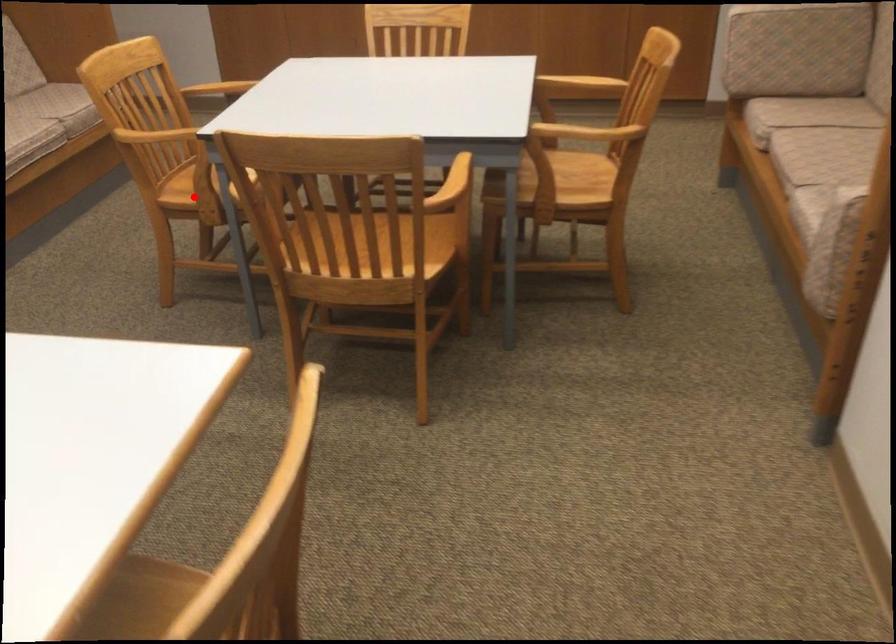
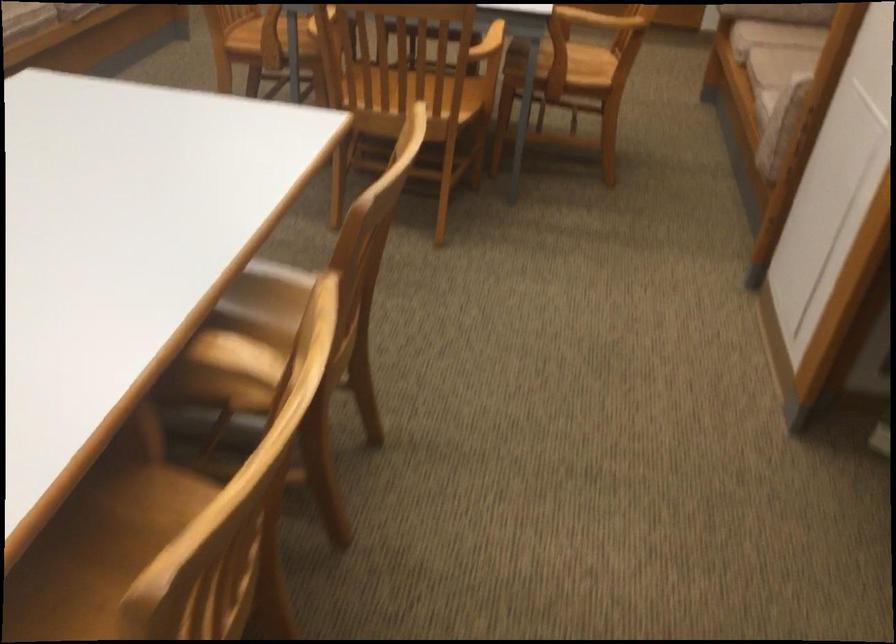
In the second image, find the point that corresponds to the highlighted location in the first image.

(254, 42)